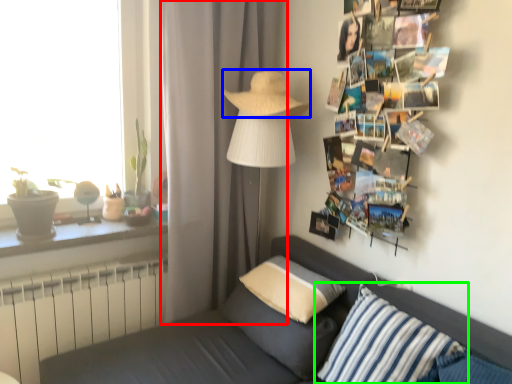
Question: Which object is the closest to the curtain (highlighted by a red box)? Choose among these: hat (highlighted by a blue box) or pillow (highlighted by a green box).

Choices:
 (A) hat
 (B) pillow

Answer: (A)